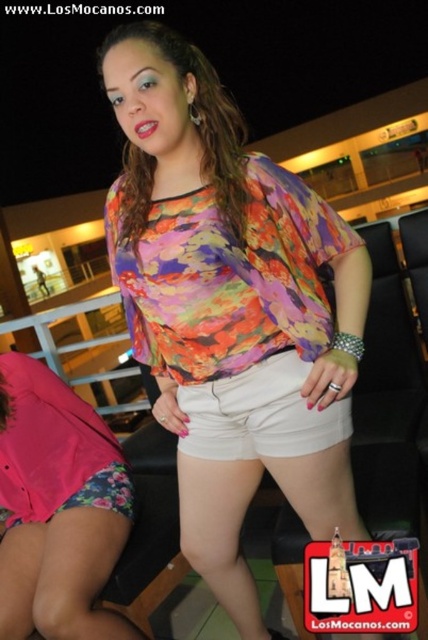
You are a photographer taking a picture of the scene. You notice two points in the image at coordinates point (x=61, y=464) and point (x=154, y=38). Which point should you focus on to ensure the subject in the foreground is sharp?

You should focus on point (x=61, y=464) because it is closer to the camera than point (x=154, y=38), ensuring the foreground subject is sharp.

You are a fashion designer observing the two pairs of shorts in the image. The pink floral shorts at lower left and the white cotton shorts at center. Which pair has a wider leg opening?

The pink floral shorts at lower left has a wider leg opening than the white cotton shorts at center because the pink floral shorts at lower left is wider than the white cotton shorts at center.

You are a photographer setting up a shoot in this scene. You want to ensure that both the pink floral shorts at lower left and the multicolored fabric blouse at center are clearly visible in the photo. Based on their positions, which object should you adjust the focus on to ensure both are in focus?

The multicolored fabric blouse at center is behind the pink floral shorts at lower left. To ensure both are in focus, you should adjust the focus on the multicolored fabric blouse at center since it is farther away, allowing the shorter distance to the pink floral shorts to also be within the depth of field.